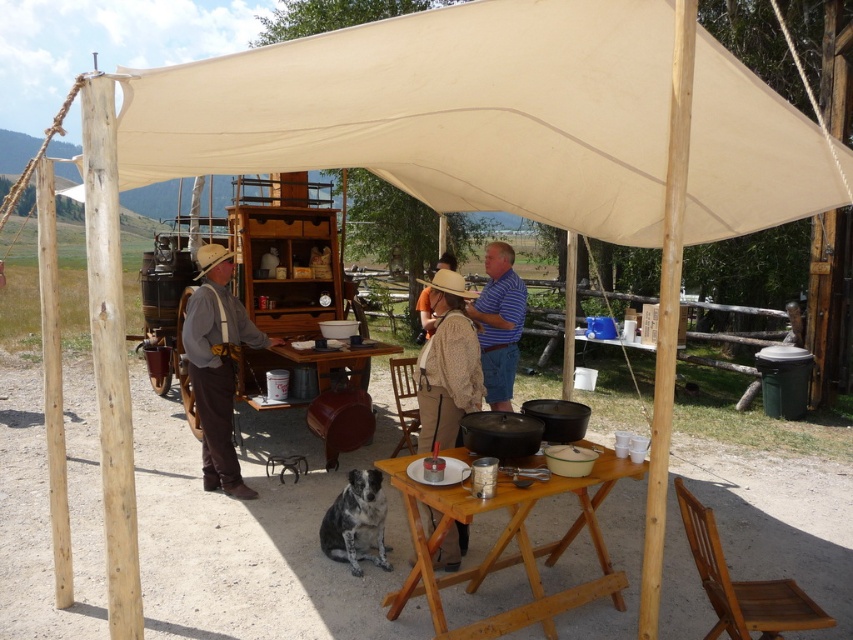
Does brown leather hat at center have a greater height compared to brown felt cowboy hat at center?

Indeed, brown leather hat at center has a greater height compared to brown felt cowboy hat at center.

Locate an element on the screen. brown leather hat at center is located at coordinates point(424,314).

Is beige canvas canopy at upper center to the left of light brown straw cowboy hat at center from the viewer's perspective?

Incorrect, beige canvas canopy at upper center is not on the left side of light brown straw cowboy hat at center.

Is beige canvas canopy at upper center above light brown straw cowboy hat at center?

Indeed, beige canvas canopy at upper center is positioned over light brown straw cowboy hat at center.

Is point (486, 157) more distant than point (425, 284)?

No.

This screenshot has width=853, height=640. What are the coordinates of `beige canvas canopy at upper center` in the screenshot? It's located at (437, 109).

Does point (531, 28) come farther from viewer compared to point (469, 324)?

That is False.

The height and width of the screenshot is (640, 853). Describe the element at coordinates (437, 109) in the screenshot. I see `beige canvas canopy at upper center` at that location.

Locate an element on the screen. The height and width of the screenshot is (640, 853). beige canvas canopy at upper center is located at coordinates (437, 109).